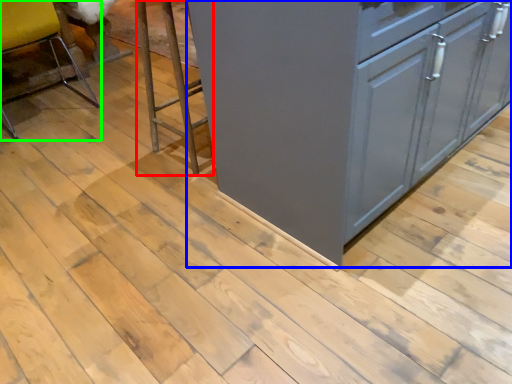
Question: Which object is positioned closest to step stool (highlighted by a red box)? Select from cabinetry (highlighted by a blue box) and chair (highlighted by a green box).

Choices:
 (A) cabinetry
 (B) chair

Answer: (A)